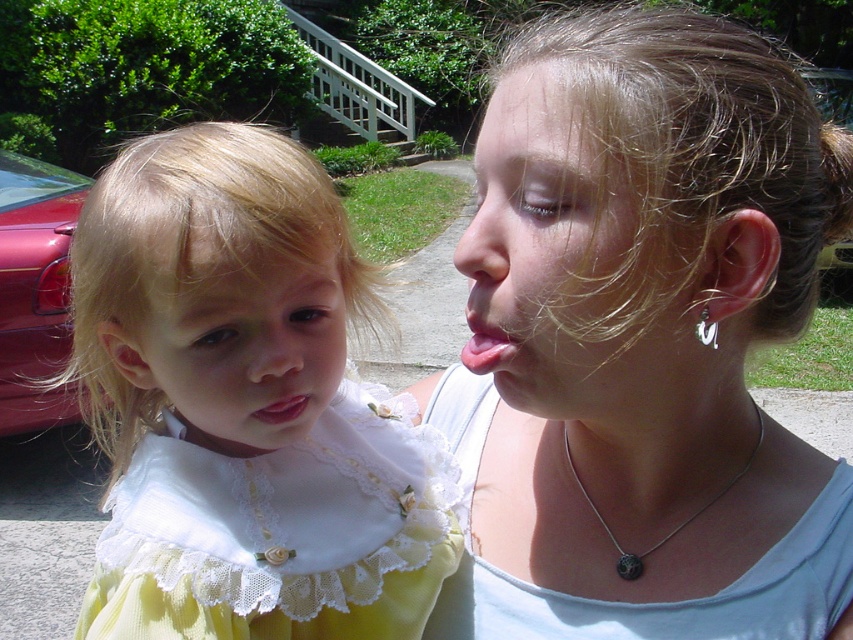
Can you confirm if matte blonde hair at center is wider than silver/black pendant at center?

Yes, matte blonde hair at center is wider than silver/black pendant at center.

Who is more distant from viewer, (538, 371) or (595, 512)?

Point (595, 512)

Find the location of a particular element. Image resolution: width=853 pixels, height=640 pixels. matte blonde hair at center is located at coordinates (560, 259).

The width and height of the screenshot is (853, 640). I want to click on matte blonde hair at center, so click(x=560, y=259).

Which is above, yellow lace dress at center or pink glossy tongue at center?

Positioned higher is pink glossy tongue at center.

Which of these two, yellow lace dress at center or pink glossy tongue at center, stands taller?

yellow lace dress at center is taller.

Is point (286, 456) positioned behind point (476, 317)?

That is True.

Locate an element on the screen. yellow lace dress at center is located at coordinates coord(280,532).

Who is positioned more to the left, silver/black pendant at center or pink glossy tongue at center?

pink glossy tongue at center is more to the left.

Is silver/black pendant at center further to the viewer compared to pink glossy tongue at center?

Yes.

What do you see at coordinates (675, 525) in the screenshot? Image resolution: width=853 pixels, height=640 pixels. I see `silver/black pendant at center` at bounding box center [675, 525].

Identify the location of silver/black pendant at center. pyautogui.click(x=675, y=525).